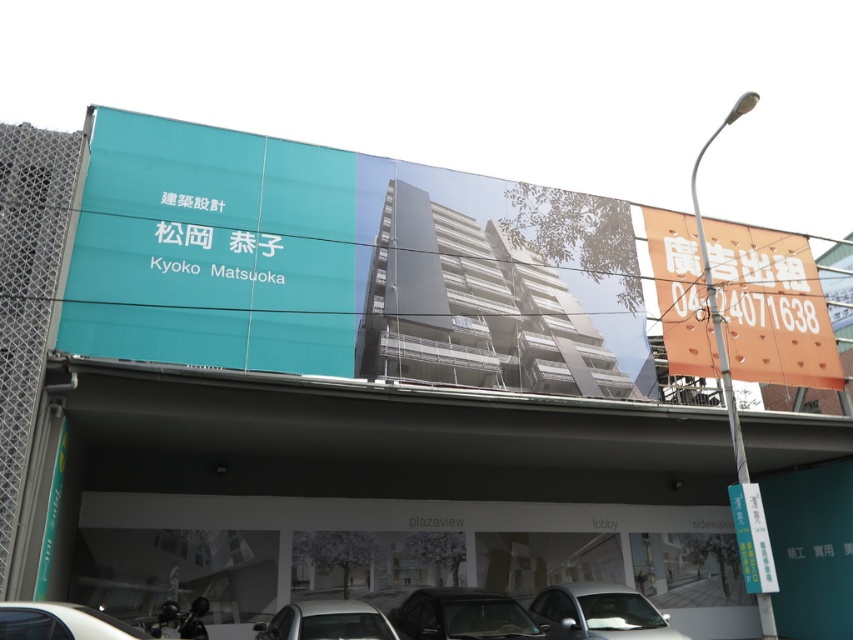
Question: Among these points, which one is farthest from the camera?

Choices:
 (A) (827, 342)
 (B) (357, 602)
 (C) (254, 218)
 (D) (448, 588)

Answer: (A)

Question: Can you confirm if teal matte signboard at upper left is positioned above silver metallic car at center?

Choices:
 (A) yes
 (B) no

Answer: (A)

Question: Among these objects, which one is farthest from the camera?

Choices:
 (A) white glossy car at lower left
 (B) silver metallic car at center

Answer: (B)

Question: Is matte black car at center positioned at the back of yellow paper at lower right?

Choices:
 (A) no
 (B) yes

Answer: (B)

Question: Which point is closer to the camera?

Choices:
 (A) matte black car at center
 (B) silver metallic car at lower center
 (C) yellow paper at lower right
 (D) silver metallic car at center

Answer: (D)

Question: Is the position of silver metallic car at lower center more distant than that of silver metallic car at center?

Choices:
 (A) yes
 (B) no

Answer: (A)